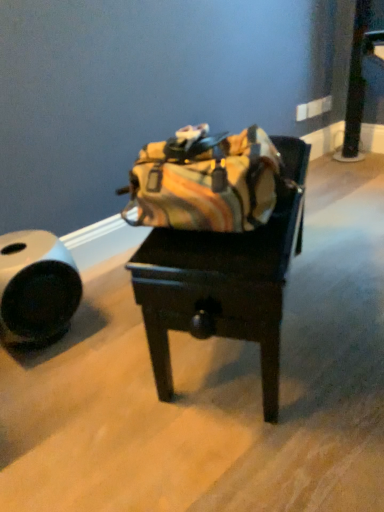
Question: In terms of width, does leather duffel bag at center look wider or thinner when compared to white matte tube at left?

Choices:
 (A) thin
 (B) wide

Answer: (B)

Question: From the image's perspective, is leather duffel bag at center above or below white matte tube at left?

Choices:
 (A) below
 (B) above

Answer: (B)

Question: Based on their positions, is leather duffel bag at center located to the left or right of white matte tube at left?

Choices:
 (A) right
 (B) left

Answer: (A)

Question: From a real-world perspective, is white matte tube at left positioned above or below leather duffel bag at center?

Choices:
 (A) below
 (B) above

Answer: (A)

Question: Is white matte tube at left inside or outside of leather duffel bag at center?

Choices:
 (A) inside
 (B) outside

Answer: (B)

Question: From the image's perspective, is white matte tube at left located above or below leather duffel bag at center?

Choices:
 (A) below
 (B) above

Answer: (A)

Question: Looking at the image, does white matte tube at left seem bigger or smaller compared to leather duffel bag at center?

Choices:
 (A) big
 (B) small

Answer: (B)